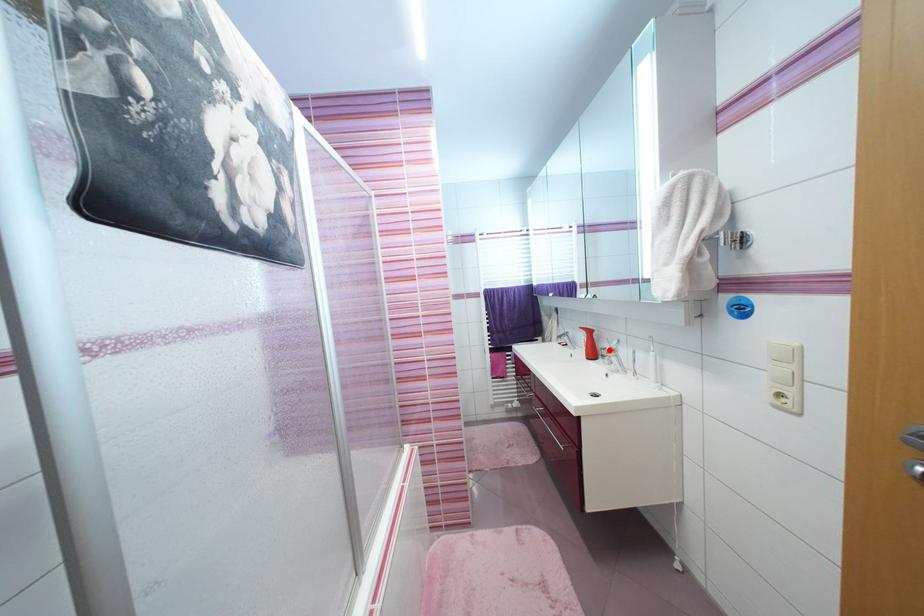
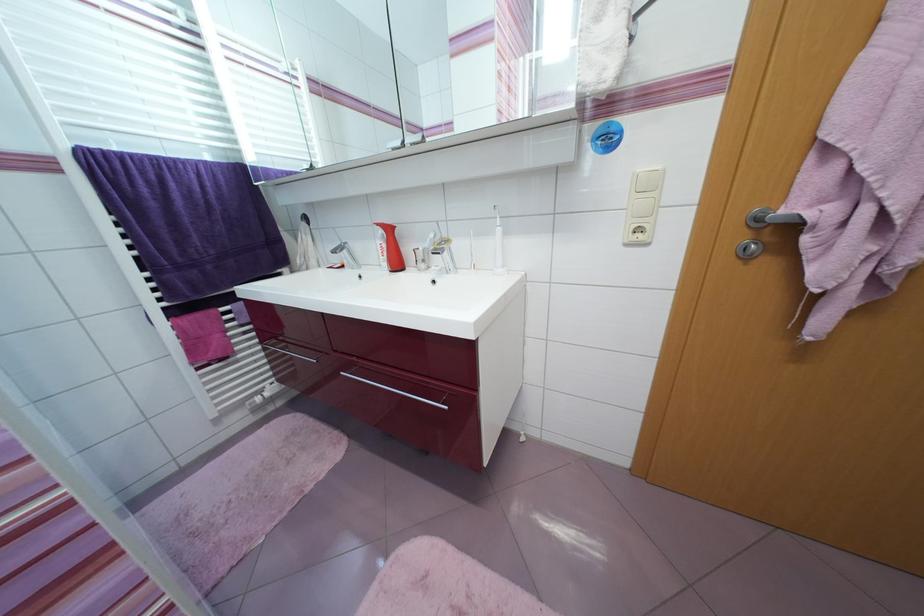
Question: I am providing you with two images of the same scene from different viewpoints. A red point is marked on the first image. At the location where the point appears in image 1, is it still visible in image 2?

Choices:
 (A) Yes
 (B) No

Answer: (A)